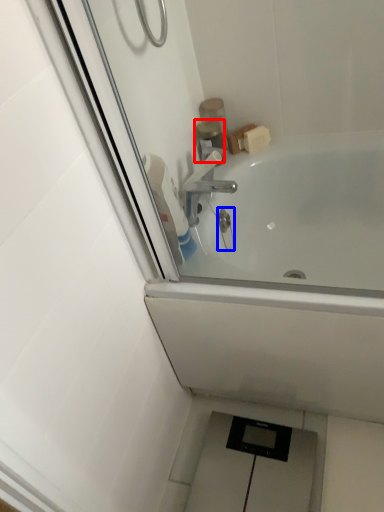
Question: Which object is further to the camera taking this photo, toiletry (highlighted by a red box) or plumbing fixture (highlighted by a blue box)?

Choices:
 (A) toiletry
 (B) plumbing fixture

Answer: (A)